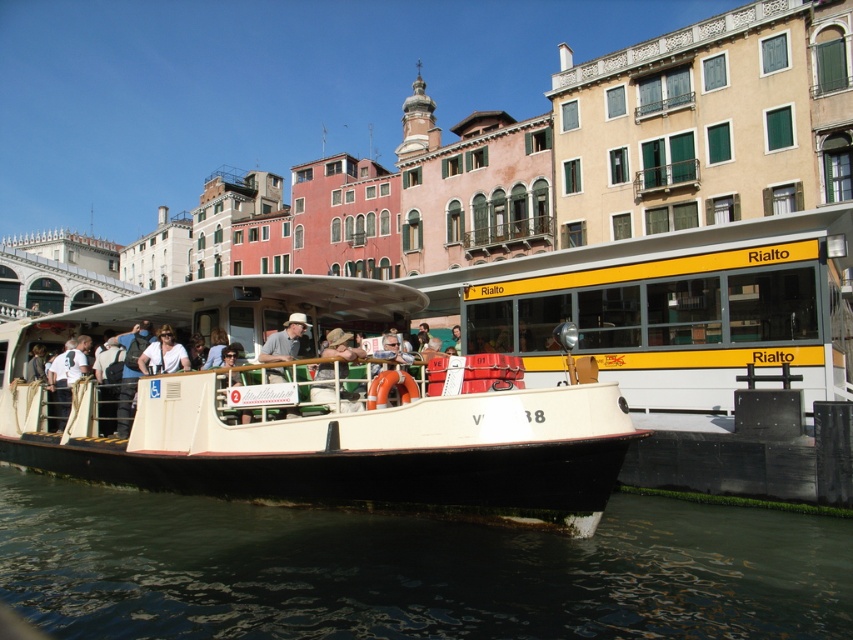
Question: Can you confirm if greenish water at lower left is wider than khaki fabric hat at center?

Choices:
 (A) yes
 (B) no

Answer: (A)

Question: Does white matte boat at center lie in front of khaki fabric hat at center?

Choices:
 (A) no
 (B) yes

Answer: (B)

Question: Which point is closer to the camera?

Choices:
 (A) (325, 392)
 (B) (146, 371)
 (C) (363, 563)
 (D) (405, 493)

Answer: (D)

Question: Which point is closer to the camera?

Choices:
 (A) (126, 468)
 (B) (115, 618)
 (C) (181, 346)
 (D) (331, 337)

Answer: (B)

Question: Which of the following is the farthest from the observer?

Choices:
 (A) khaki fabric hat at center
 (B) white matte boat at center

Answer: (A)

Question: Can you confirm if white matte boat at center is positioned above khaki fabric hat at center?

Choices:
 (A) no
 (B) yes

Answer: (B)